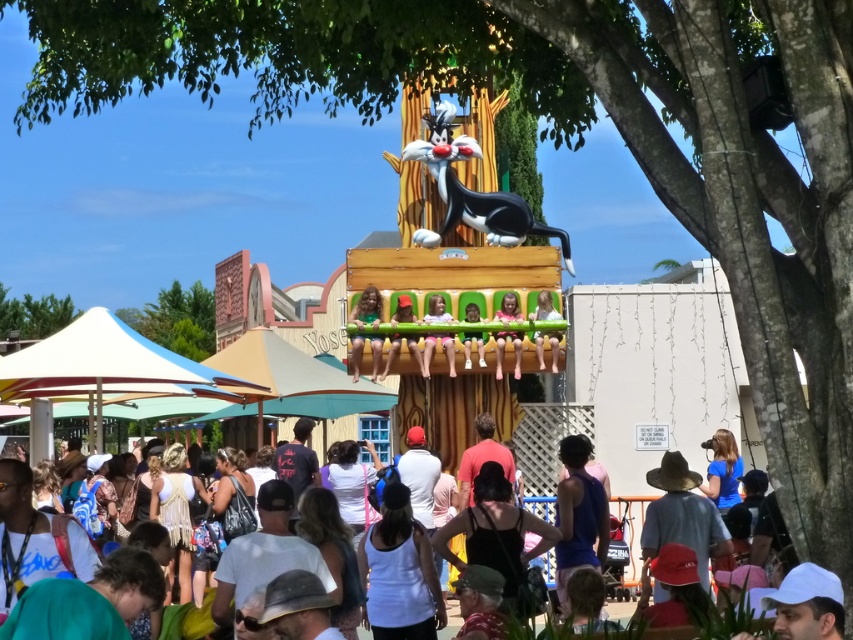
You are planning to sit on one of the seats in the center of the float. The pastel plastic seats at center and the green fabric chair at center are available. If you want to choose the wider seating option, which one should you pick?

The pastel plastic seats at center is wider than the green fabric chair at center, so you should pick the pastel plastic seats at center.

You are a maintenance worker needing to reach the green fabric chair at center from the white cotton crowd at lower center. Given that you can carry a ladder that extends up to 10 meters, will you be able to reach the chair without needing additional equipment?

The green fabric chair at center and white cotton crowd at lower center are 19.05 meters apart. Since the ladder only extends up to 10 meters, you will need additional equipment to reach the chair.